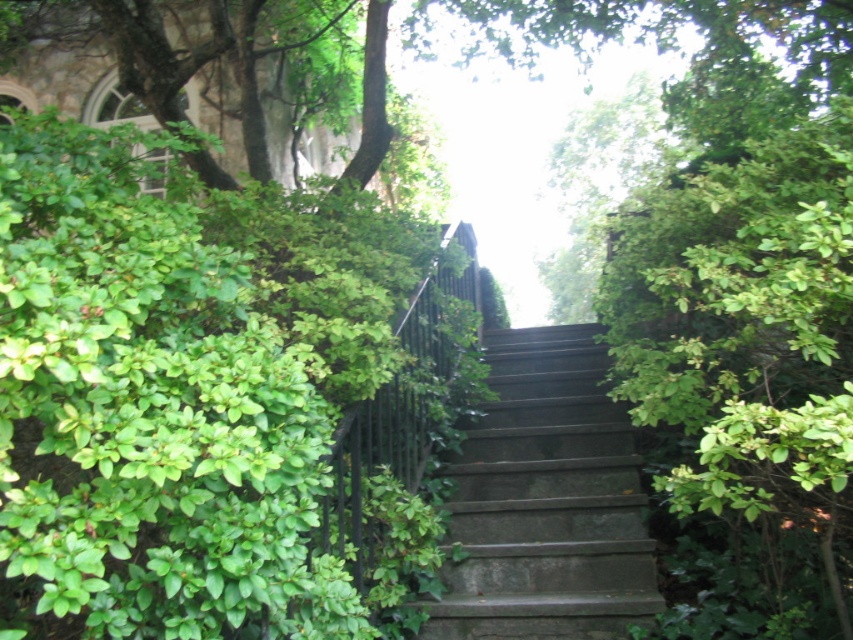
You are a hiker planning to climb the dark gray stone stairs at center. There is a green leafy tree at upper center blocking your path. Can you pass under the tree without bending down?

The dark gray stone stairs at center is much taller than the green leafy tree at upper center, so you can pass under the tree without bending down.

You are hiking up the dark gray stone stairs at center and want to reach the green leafy tree at upper center. Which direction should you go to get closer to the tree?

The dark gray stone stairs at center are below the green leafy tree at upper center, so you should go upwards along the stairs to get closer to the tree.

You are standing at the bottom of the stone steps and want to reach the top. There is a green leafy bush at left. Can you walk directly up the steps without stepping on the bush?

The green leafy bush at left is located at point (213, 401), which is to the side of the steps. Since the steps themselves are the path leading upwards and the bush is positioned to the left, you can walk directly up the steps without stepping on the bush.